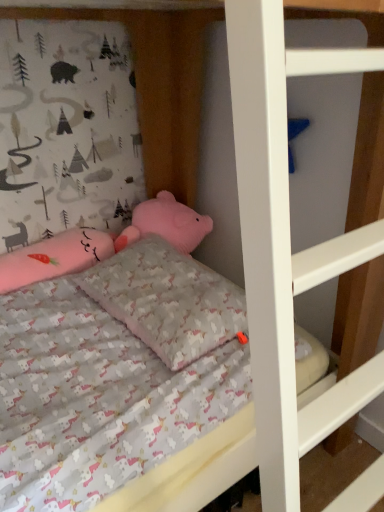
The height and width of the screenshot is (512, 384). In order to click on matte pink pillow at center in this screenshot , I will do `click(168, 300)`.

Image resolution: width=384 pixels, height=512 pixels. Describe the element at coordinates (168, 300) in the screenshot. I see `matte pink pillow at center` at that location.

You are a GUI agent. You are given a task and a screenshot of the screen. Output one action in this format:
    pyautogui.click(x=<x>, y=<y>)
    Task: Click on the matte pink pillow at center
    
    Given the screenshot: What is the action you would take?
    pyautogui.click(x=168, y=300)